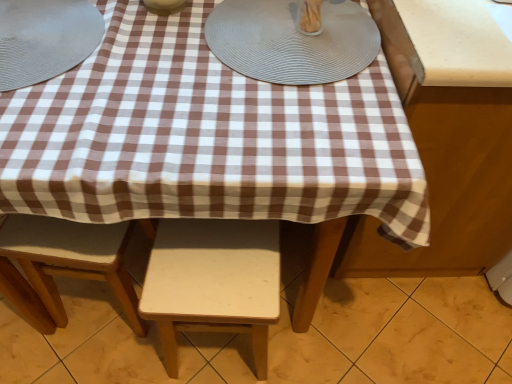
Question: Which direction should I rotate to look at light wood stool at lower center, the 1th stool positioned from the left?

Choices:
 (A) right
 (B) left

Answer: (B)

Question: In which direction should I rotate to look at matte ceramic bowl at upper center, the second tableware when ordered from right to left?

Choices:
 (A) right
 (B) left

Answer: (B)

Question: Considering the relative sizes of light wood stool at lower center, the 1th stool positioned from the left, and matte ceramic bowl at upper center, the second tableware when ordered from right to left, in the image provided, is light wood stool at lower center, the 1th stool positioned from the left, wider than matte ceramic bowl at upper center, the second tableware when ordered from right to left,?

Choices:
 (A) yes
 (B) no

Answer: (A)

Question: Can you confirm if light wood stool at lower center, the 1th stool positioned from the left, is positioned to the right of matte ceramic bowl at upper center, the second tableware when ordered from right to left?

Choices:
 (A) yes
 (B) no

Answer: (B)

Question: Is matte ceramic bowl at upper center, the second tableware when ordered from right to left, a part of light wood stool at lower center, the 1th stool positioned from the left?

Choices:
 (A) no
 (B) yes

Answer: (A)

Question: Is matte ceramic bowl at upper center, which ranks as the 2th tableware in left-to-right order, at the back of light wood stool at lower center, placed as the 2th stool when sorted from right to left?

Choices:
 (A) no
 (B) yes

Answer: (A)

Question: Does light wood stool at lower center, the 1th stool positioned from the left, have a lesser width compared to matte ceramic bowl at upper center, which ranks as the 2th tableware in left-to-right order?

Choices:
 (A) no
 (B) yes

Answer: (A)

Question: Does light wood stool at lower center, placed as the 2th stool when sorted from right to left, have a smaller size compared to matte ceramic bowl at upper center, the second tableware when ordered from right to left?

Choices:
 (A) yes
 (B) no

Answer: (B)

Question: Can you confirm if clear glass container at upper center, placed as the first tableware when sorted from right to left, is taller than white matte stool at center, arranged as the first stool when viewed from the right?

Choices:
 (A) yes
 (B) no

Answer: (B)

Question: Does clear glass container at upper center, placed as the first tableware when sorted from right to left, appear on the right side of white matte stool at center, arranged as the first stool when viewed from the right?

Choices:
 (A) yes
 (B) no

Answer: (A)

Question: Is clear glass container at upper center, which is counted as the 3th tableware, starting from the left, surrounding white matte stool at center, arranged as the first stool when viewed from the right?

Choices:
 (A) yes
 (B) no

Answer: (B)

Question: Is clear glass container at upper center, placed as the first tableware when sorted from right to left, closer to the viewer compared to white matte stool at center, arranged as the first stool when viewed from the right?

Choices:
 (A) yes
 (B) no

Answer: (A)

Question: From the image's perspective, is clear glass container at upper center, placed as the first tableware when sorted from right to left, on white matte stool at center, which ranks as the 2th stool in left-to-right order?

Choices:
 (A) yes
 (B) no

Answer: (A)

Question: From a real-world perspective, is clear glass container at upper center, which is counted as the 3th tableware, starting from the left, positioned over white matte stool at center, arranged as the first stool when viewed from the right, based on gravity?

Choices:
 (A) yes
 (B) no

Answer: (A)

Question: Is the depth of brown checkered tablecloth at right less than that of clear glass container at upper center, placed as the first tableware when sorted from right to left?

Choices:
 (A) no
 (B) yes

Answer: (B)